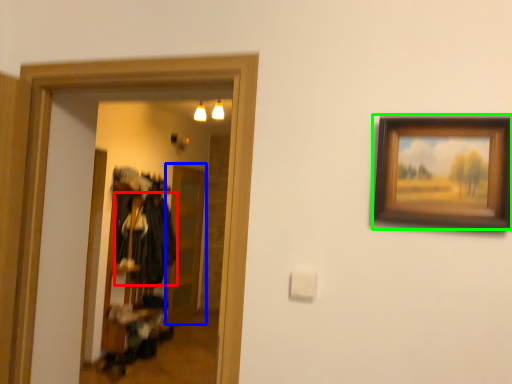
Question: Considering the real-world distances, which object is closest to clothing (highlighted by a red box)? glass door (highlighted by a blue box) or picture frame (highlighted by a green box).

Choices:
 (A) glass door
 (B) picture frame

Answer: (A)